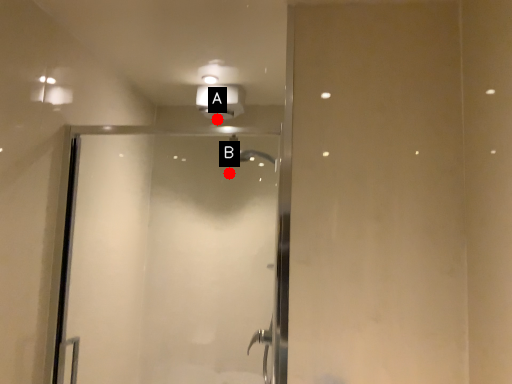
Question: Two points are circled on the image, labeled by A and B beside each circle. Which point appears farthest from the camera in this image?

Choices:
 (A) A is further
 (B) B is further

Answer: (A)